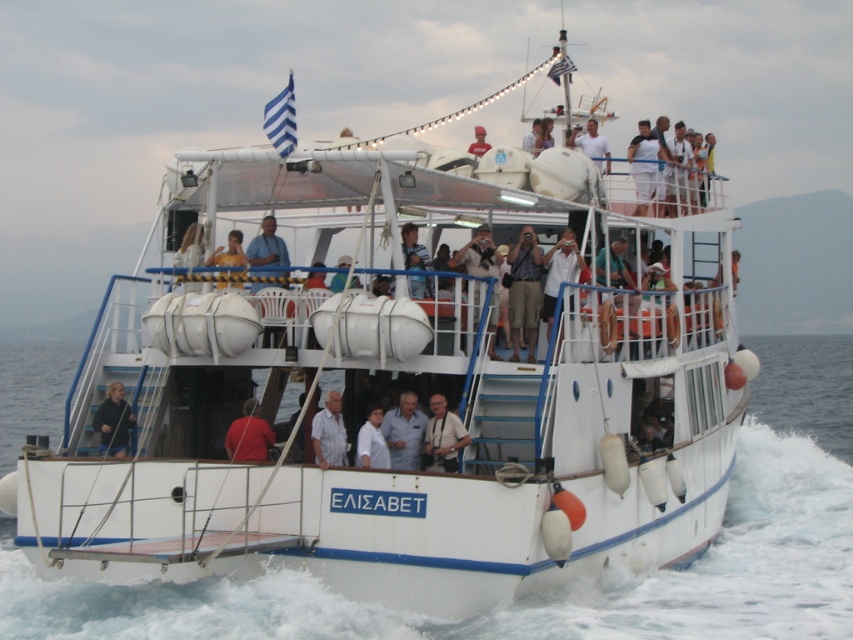
Is white striped shirt at center smaller than light brown wooden chair at upper center?

Yes.

In the scene shown: Who is higher up, white striped shirt at center or light brown wooden chair at upper center?

light brown wooden chair at upper center is above.

Where is `white striped shirt at center`? white striped shirt at center is located at coordinates (329, 433).

Is blue shirt at center thinner than dark blue fabric jacket at center?

Correct, blue shirt at center's width is less than dark blue fabric jacket at center's.

Does blue shirt at center have a larger size compared to dark blue fabric jacket at center?

Yes.

What do you see at coordinates (404, 433) in the screenshot? Image resolution: width=853 pixels, height=640 pixels. I see `blue shirt at center` at bounding box center [404, 433].

At what (x,y) coordinates should I click in order to perform the action: click on blue shirt at center. Please return your answer as a coordinate pair (x, y). Looking at the image, I should click on (404, 433).

Who is positioned more to the left, blue shirt at center or white matte shirt at center?

From the viewer's perspective, white matte shirt at center appears more on the left side.

Can you confirm if blue shirt at center is thinner than white matte shirt at center?

No, blue shirt at center is not thinner than white matte shirt at center.

Find the location of a particular element. The height and width of the screenshot is (640, 853). blue shirt at center is located at coordinates (404, 433).